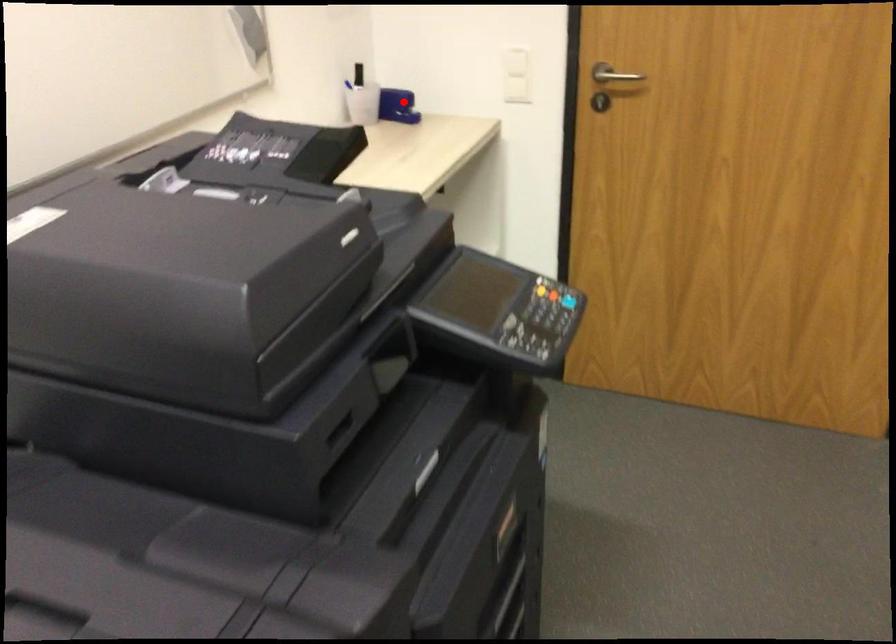
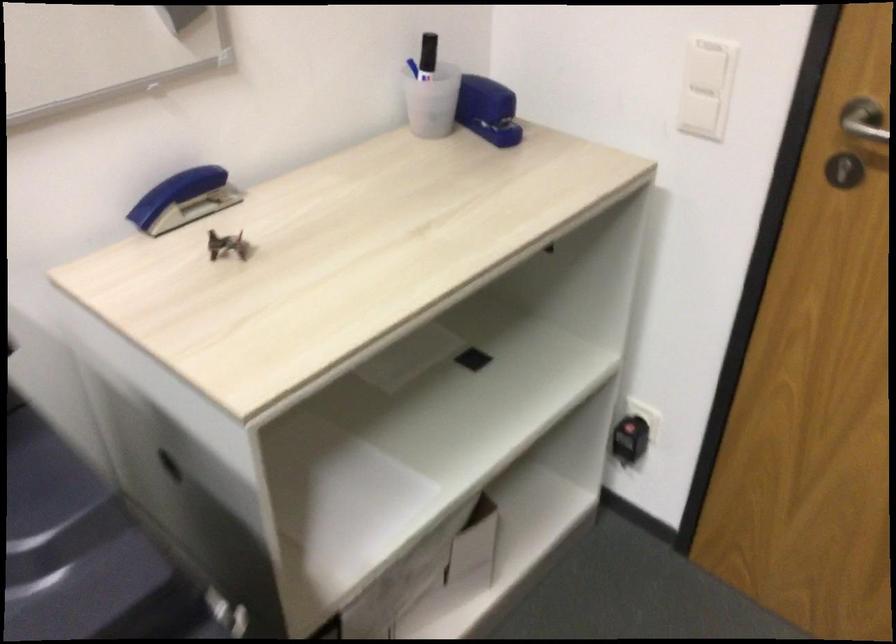
Question: I am providing you with two images of the same scene from different viewpoints. Given a red point in image1, look at the same physical point in image2. Is it:

Choices:
 (A) Closer to the viewpoint
 (B) Farther from the viewpoint

Answer: (A)